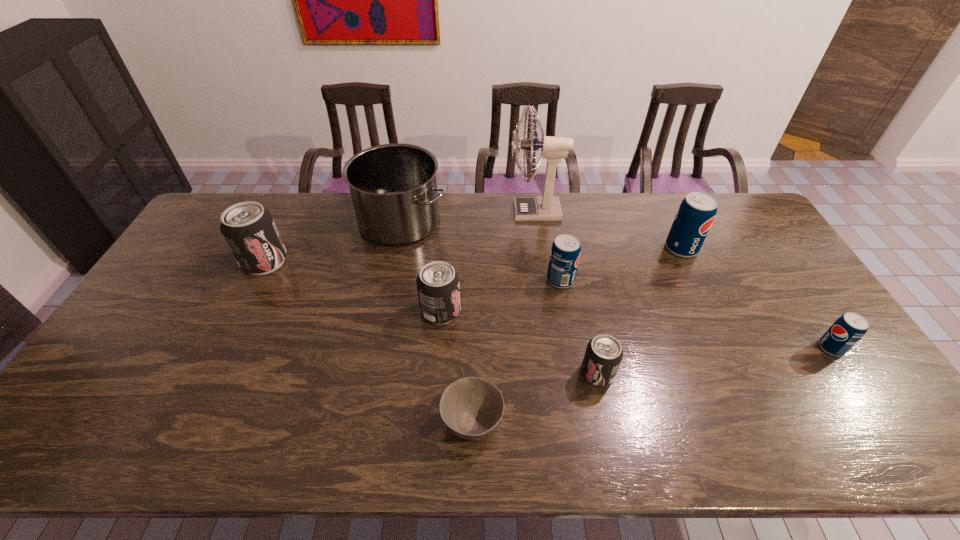
This screenshot has height=540, width=960. What are the coordinates of `black soda can identified as the closest to the fan` in the screenshot? It's located at (438, 286).

Where is `black soda can that is the second closest one to the nearest soda can`? This screenshot has width=960, height=540. black soda can that is the second closest one to the nearest soda can is located at coordinates (249, 229).

Where is `vacant space that satisfies the following two spatial constraints: 1. on the front side of the biggest black soda can; 2. on the left side of the second biggest blue pop`? The image size is (960, 540). vacant space that satisfies the following two spatial constraints: 1. on the front side of the biggest black soda can; 2. on the left side of the second biggest blue pop is located at coordinates (255, 280).

This screenshot has height=540, width=960. What are the coordinates of `free space that satisfies the following two spatial constraints: 1. on the front-facing side of the tallest object; 2. on the right side of the rightmost blue pop` in the screenshot? It's located at (555, 348).

Find the location of a particular element. free space that satisfies the following two spatial constraints: 1. on the front-facing side of the second nearest soda can; 2. on the right side of the tallest object is located at coordinates (555, 348).

Image resolution: width=960 pixels, height=540 pixels. In order to click on vacant space that satisfies the following two spatial constraints: 1. on the front-facing side of the blue fan; 2. on the left side of the smallest black soda can in this screenshot , I will do `click(558, 373)`.